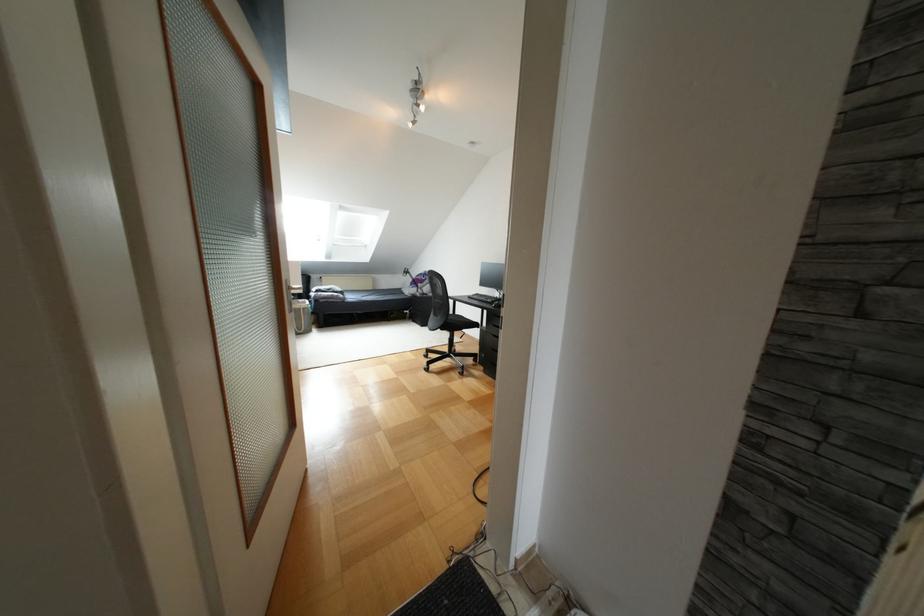
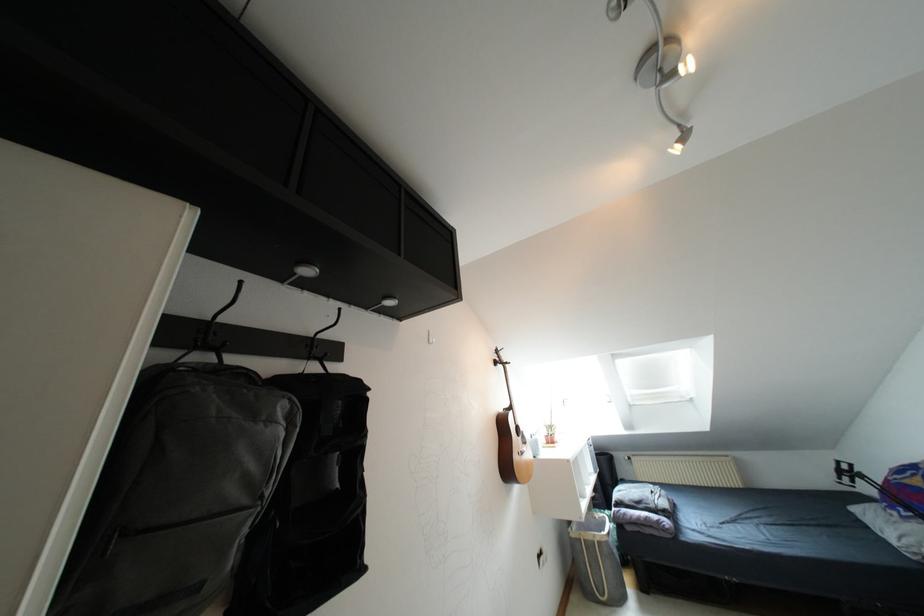
In the second image, find the point that corresponds to the point at 418,105 in the first image.

(671, 76)